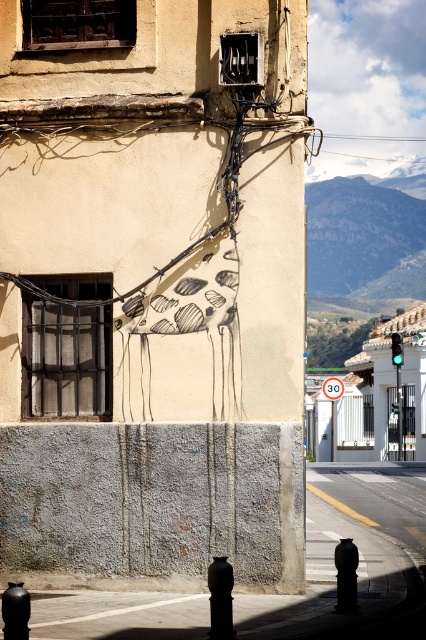
Question: Which point is farther to the camera?

Choices:
 (A) (325, 385)
 (B) (394, 333)

Answer: (A)

Question: Which point is farther to the camera?

Choices:
 (A) orange plastic speed limit sign at center
 (B) green glass traffic light at right

Answer: (A)

Question: Which object is closer to the camera taking this photo?

Choices:
 (A) orange plastic speed limit sign at center
 (B) green glass traffic light at right

Answer: (B)

Question: Does orange plastic speed limit sign at center appear on the right side of green glass traffic light at right?

Choices:
 (A) yes
 (B) no

Answer: (B)

Question: Is orange plastic speed limit sign at center further to camera compared to green glass traffic light at right?

Choices:
 (A) yes
 (B) no

Answer: (A)

Question: Is orange plastic speed limit sign at center positioned before green glass traffic light at right?

Choices:
 (A) no
 (B) yes

Answer: (A)